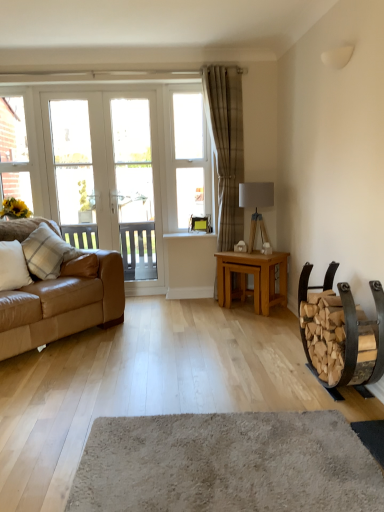
Question: Looking at the image, does matte gray lamp at center seem bigger or smaller compared to wooden log rack at right?

Choices:
 (A) big
 (B) small

Answer: (B)

Question: Considering the positions of matte gray lamp at center and wooden log rack at right in the image, is matte gray lamp at center wider or thinner than wooden log rack at right?

Choices:
 (A) wide
 (B) thin

Answer: (B)

Question: Which of these objects is positioned closest to the soft beige carpet at center?

Choices:
 (A) white plastic window frame at upper left, which is the 1th window frame in left-to-right order
 (B) light oak table at center
 (C) white glass door at left
 (D) white plastic window at upper center, the 1th window frame in the right-to-left sequence
 (E) beige textured curtain at center

Answer: (B)

Question: Based on their relative distances, which object is nearer to the white glass screen door at center?

Choices:
 (A) light oak table at center
 (B) soft beige carpet at center
 (C) leather couch at left
 (D) white glass door at left
 (E) plaid fabric pillow at left, marked as the 1th pillow in a back-to-front arrangement

Answer: (D)